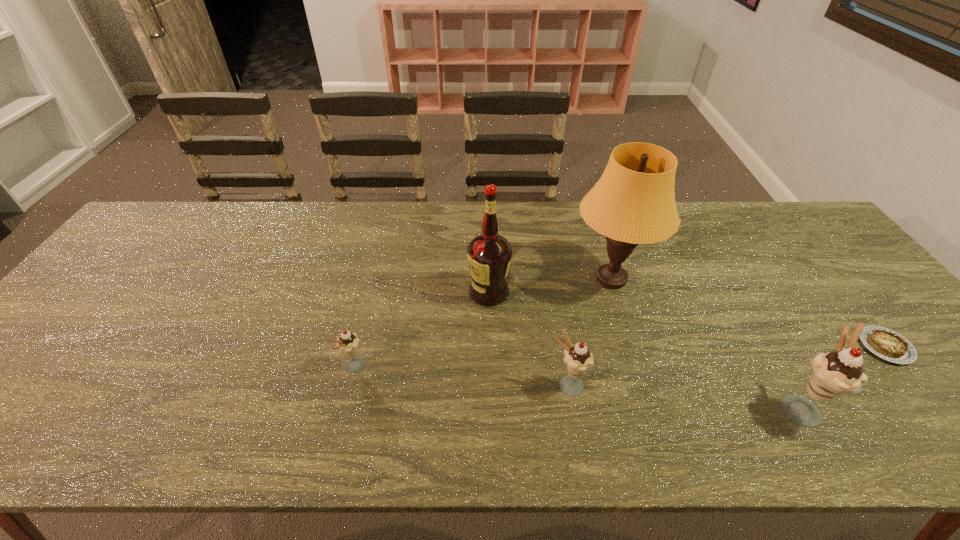
Where is `the second shortest object`? The width and height of the screenshot is (960, 540). the second shortest object is located at coordinates (348, 343).

I want to click on the leftmost icecream, so click(x=348, y=343).

At what (x,y) coordinates should I click in order to perform the action: click on the fourth tallest object. Please return your answer as a coordinate pair (x, y). Image resolution: width=960 pixels, height=540 pixels. Looking at the image, I should click on (578, 359).

This screenshot has height=540, width=960. Find the location of `the second icecream from left to right`. the second icecream from left to right is located at coordinates (578, 359).

Where is `the second object from right to left`? The image size is (960, 540). the second object from right to left is located at coordinates [x=834, y=374].

The width and height of the screenshot is (960, 540). I want to click on the tallest icecream, so click(834, 374).

You are a GUI agent. You are given a task and a screenshot of the screen. Output one action in this format:
    pyautogui.click(x=<x>, y=<y>)
    Task: Click on the lampshade
    
    Given the screenshot: What is the action you would take?
    pyautogui.click(x=633, y=203)

Find the location of a particular element. The width and height of the screenshot is (960, 540). quiche is located at coordinates (889, 345).

Image resolution: width=960 pixels, height=540 pixels. What are the coordinates of `the shortest object` in the screenshot? It's located at (889, 345).

The image size is (960, 540). Identify the location of alcohol. (489, 254).